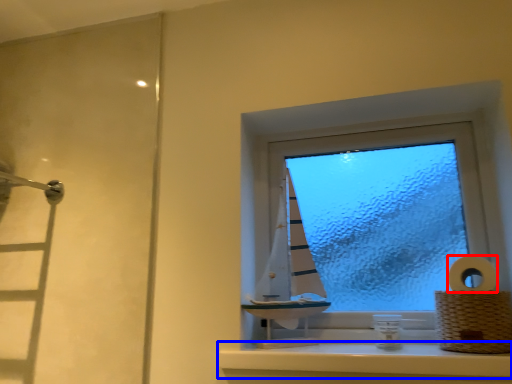
Question: Which point is further to the camera, toilet paper (highlighted by a red box) or window sill (highlighted by a blue box)?

Choices:
 (A) toilet paper
 (B) window sill

Answer: (A)